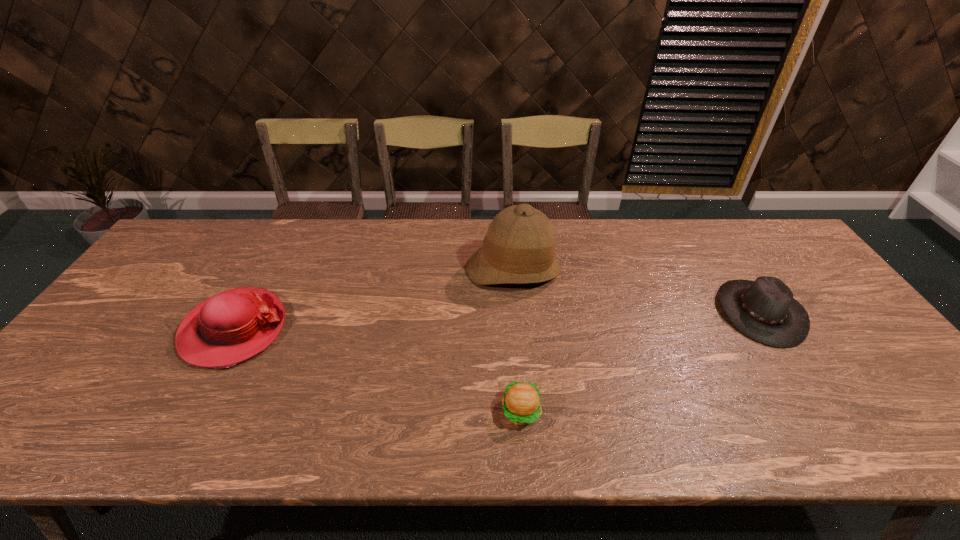
Where is `vacant space located 0.270m on the front-facing side of the shortest hat`? vacant space located 0.270m on the front-facing side of the shortest hat is located at coordinates (621, 312).

Where is `vacant space located on the front-facing side of the shortest hat`? vacant space located on the front-facing side of the shortest hat is located at coordinates (651, 312).

The width and height of the screenshot is (960, 540). Find the location of `free space located 0.240m on the front-facing side of the shortest hat`. free space located 0.240m on the front-facing side of the shortest hat is located at coordinates (633, 312).

Identify the location of free space located 0.200m on the back of the shortest object. (515, 326).

What are the coordinates of `object positioned at the far edge` in the screenshot? It's located at (519, 248).

I want to click on object that is at the near edge, so click(521, 403).

Find the location of a particular element. The height and width of the screenshot is (540, 960). object at the right edge is located at coordinates (764, 310).

Image resolution: width=960 pixels, height=540 pixels. In order to click on vacant space at the far edge of the desktop in this screenshot , I will do `click(381, 230)`.

Identify the location of vacant space at the left edge of the desktop. (84, 390).

In the image, there is a desktop. Where is `vacant space at the right edge`? The width and height of the screenshot is (960, 540). vacant space at the right edge is located at coordinates (838, 315).